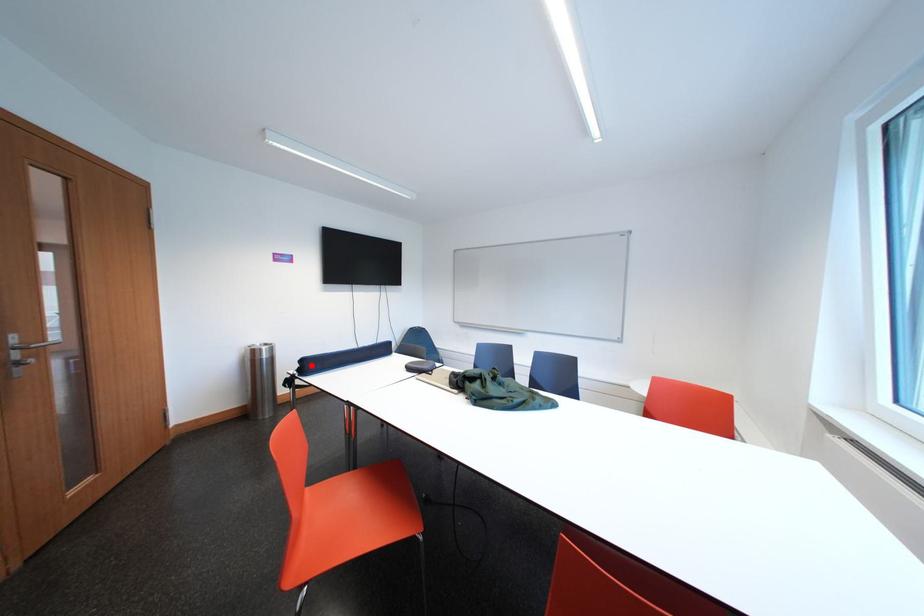
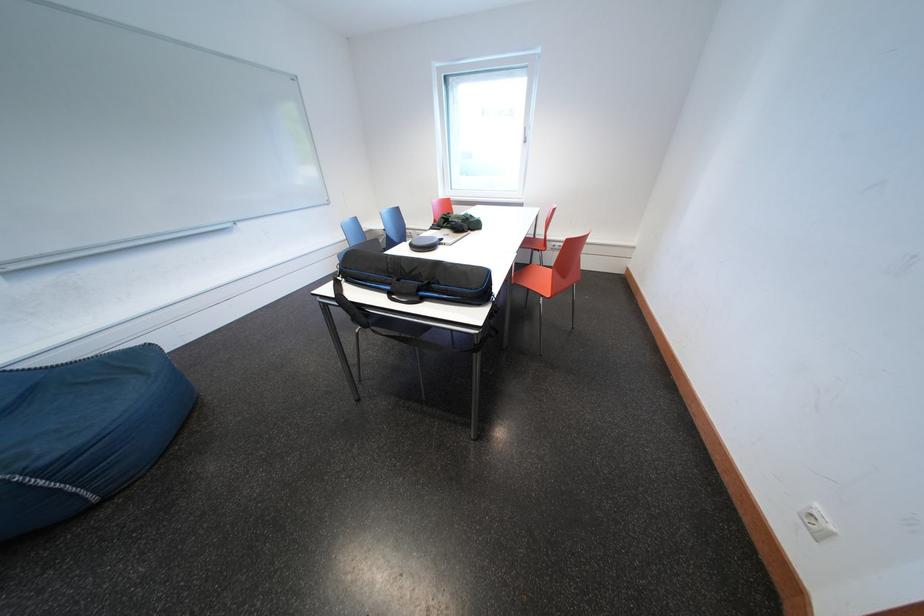
Question: I am providing you with two images of the same scene from different viewpoints. A red point is marked on the first image. At the location where the point appears in image 1, is it still visible in image 2?

Choices:
 (A) Yes
 (B) No

Answer: (B)